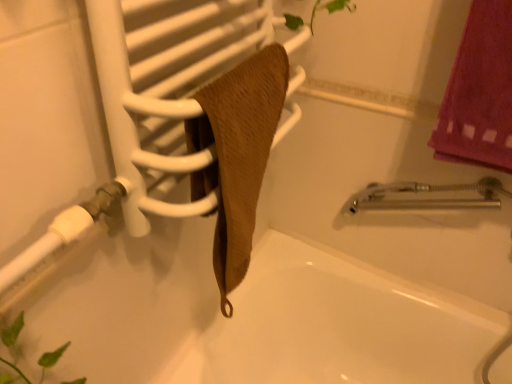
Question: Would you say white matte bathtub at center is outside white matte shower at lower left?

Choices:
 (A) yes
 (B) no

Answer: (A)

Question: Can you confirm if white matte bathtub at center is bigger than white matte shower at lower left?

Choices:
 (A) yes
 (B) no

Answer: (A)

Question: From the image's perspective, is white matte bathtub at center beneath white matte shower at lower left?

Choices:
 (A) yes
 (B) no

Answer: (A)

Question: Can you confirm if white matte bathtub at center is thinner than white matte shower at lower left?

Choices:
 (A) yes
 (B) no

Answer: (B)

Question: Is white matte bathtub at center oriented away from white matte shower at lower left?

Choices:
 (A) no
 (B) yes

Answer: (A)

Question: Is white matte bathtub at center smaller than white matte shower at lower left?

Choices:
 (A) yes
 (B) no

Answer: (B)

Question: Can you confirm if brown textured towel at center is taller than brown textured towel at center?

Choices:
 (A) yes
 (B) no

Answer: (A)

Question: Is brown textured towel at center at the left side of brown textured towel at center?

Choices:
 (A) no
 (B) yes

Answer: (A)

Question: Could you tell me if brown textured towel at center is facing brown textured towel at center?

Choices:
 (A) yes
 (B) no

Answer: (A)

Question: Is brown textured towel at center completely or partially outside of brown textured towel at center?

Choices:
 (A) yes
 (B) no

Answer: (B)

Question: Is brown textured towel at center placed right next to brown textured towel at center?

Choices:
 (A) yes
 (B) no

Answer: (A)

Question: From the image's perspective, is brown textured towel at center below brown textured towel at center?

Choices:
 (A) no
 (B) yes

Answer: (B)

Question: Are white matte shower at lower left and white matte bathtub at center located far from each other?

Choices:
 (A) yes
 (B) no

Answer: (B)